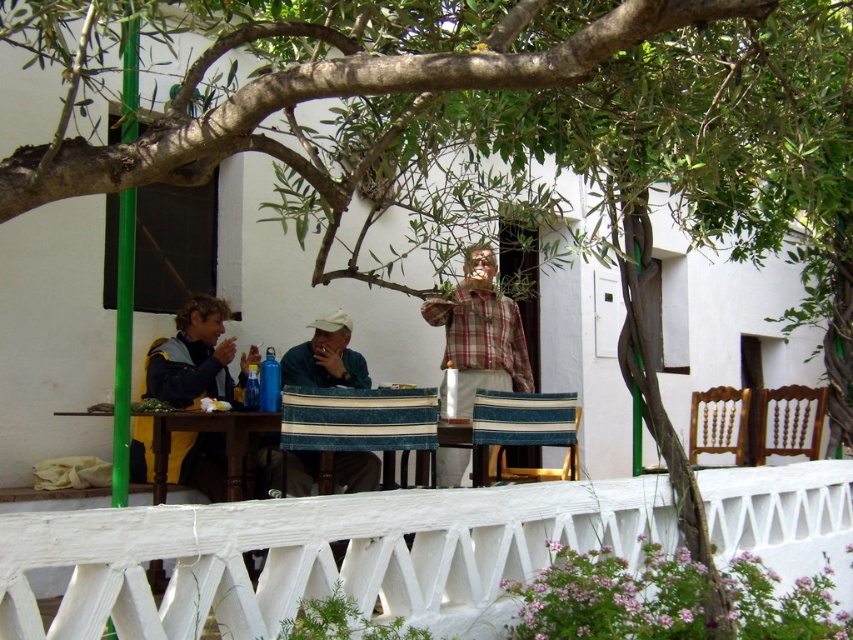
Question: Estimate the real-world distances between objects in this image. Which object is closer to the matte beige cap at center?

Choices:
 (A) matte black jacket at left
 (B) white painted wood at lower center

Answer: (A)

Question: Among these points, which one is farthest from the camera?

Choices:
 (A) (190, 513)
 (B) (480, 332)

Answer: (B)

Question: Can you confirm if matte blue water bottle at center is smaller than plaid fabric shirt at center?

Choices:
 (A) no
 (B) yes

Answer: (B)

Question: Can you confirm if plaid fabric shirt at center is smaller than matte beige cap at center?

Choices:
 (A) yes
 (B) no

Answer: (B)

Question: Does matte blue water bottle at center appear over plaid fabric shirt at center?

Choices:
 (A) yes
 (B) no

Answer: (A)

Question: Among these objects, which one is nearest to the camera?

Choices:
 (A) plaid fabric shirt at center
 (B) matte black jacket at left

Answer: (B)